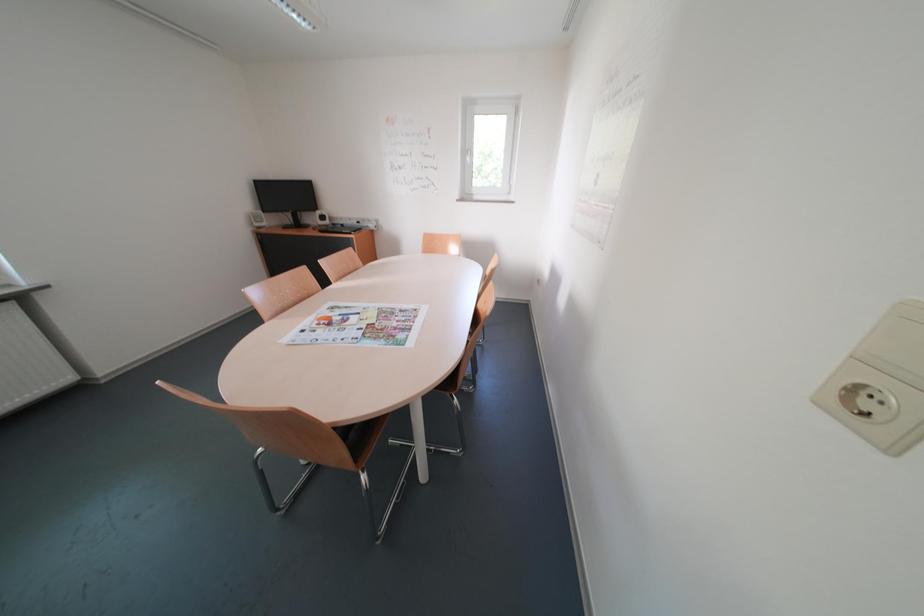
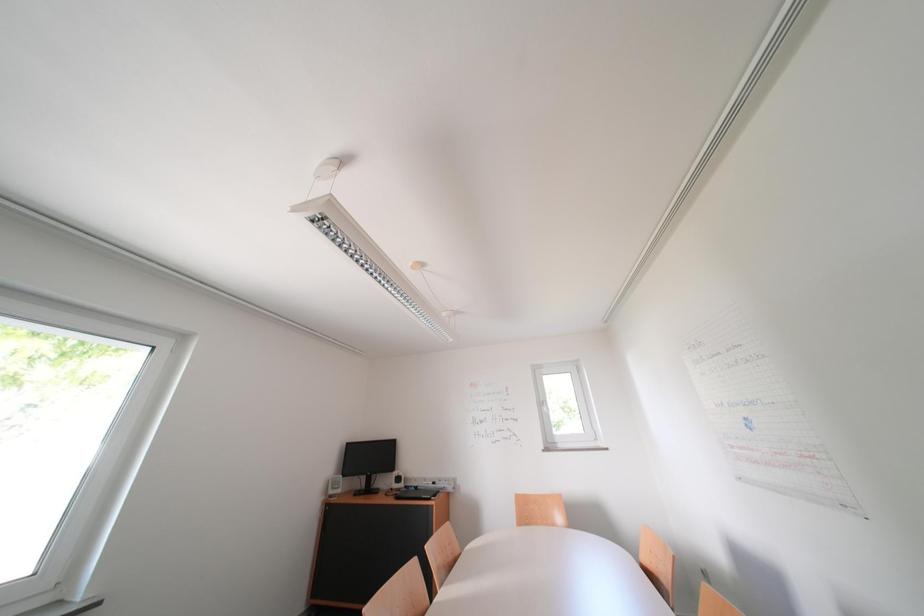
Question: The images are taken continuously from a first-person perspective. In which direction is your viewpoint rotating?

Choices:
 (A) Left
 (B) Right
 (C) Up
 (D) Down

Answer: (C)